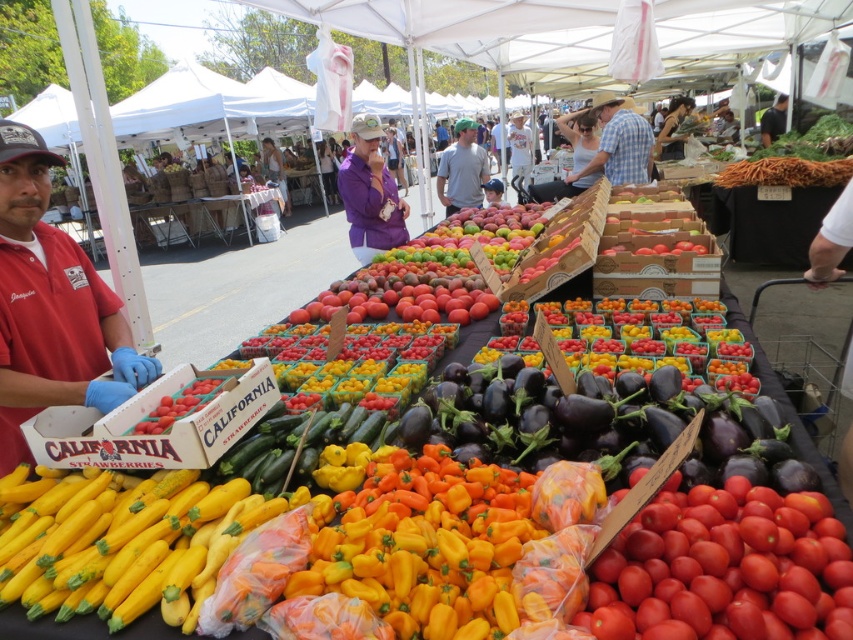
You are a vendor at the farmer market and you want to display two shirts on a rack. The purple fabric shirt at center and the gray cotton shirt at center. Which shirt should you place on the left side of the rack if you want the wider shirt to be on the right side?

The gray cotton shirt at center is wider than the purple fabric shirt at center, so you should place the gray cotton shirt at center on the right side of the rack.

You are standing at the entrance of the farmer market and see two points marked in the image. The first point is at the location of point (393, 224) and the second point is at point (463, 202). Which point is closer to you?

Point (393, 224) is in front of point (463, 202), so it is closer to you.

You are a vendor at the farmer market and you want to hang a sign between the checkered fabric shirt at center and the gray cotton shirt at center. Which shirt should the sign be placed closer to if you want the sign to be closer to the larger one?

The checkered fabric shirt at center is larger than the gray cotton shirt at center, so the sign should be placed closer to the checkered fabric shirt at center.